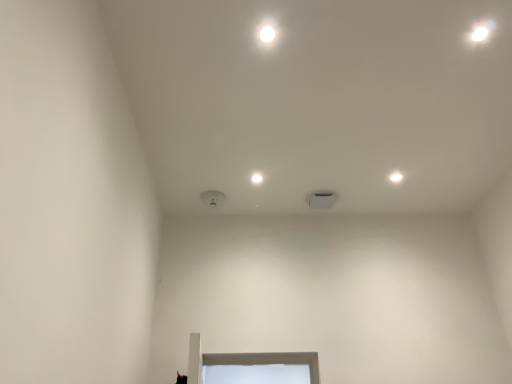
Question: Is white matte light fixture at upper right, the 1th dot viewed from the right, situated inside white matte square at center, the 1th dot from the left, or outside?

Choices:
 (A) outside
 (B) inside

Answer: (A)

Question: Does point coord(393,180) appear closer or farther from the camera than point coord(253,177)?

Choices:
 (A) farther
 (B) closer

Answer: (A)

Question: From the image's perspective, is white matte light fixture at upper right, the 2th dot positioned from the left, positioned above or below white matte square at center, the 2th dot in the right-to-left sequence?

Choices:
 (A) above
 (B) below

Answer: (A)

Question: From the image's perspective, relative to white matte light fixture at upper right, the 2th dot positioned from the left, is white matte square at center, the 2th dot in the right-to-left sequence, above or below?

Choices:
 (A) below
 (B) above

Answer: (A)

Question: Considering their positions, is white matte square at center, the 2th dot in the right-to-left sequence, located in front of or behind white matte light fixture at upper right, the 1th dot viewed from the right?

Choices:
 (A) front
 (B) behind

Answer: (A)

Question: Based on their positions, is white matte square at center, the 1th dot from the left, located to the left or right of white matte light fixture at upper right, the 1th dot viewed from the right?

Choices:
 (A) left
 (B) right

Answer: (A)

Question: In terms of size, does white matte square at center, the 1th dot from the left, appear bigger or smaller than white matte light fixture at upper right, the 1th dot viewed from the right?

Choices:
 (A) big
 (B) small

Answer: (A)